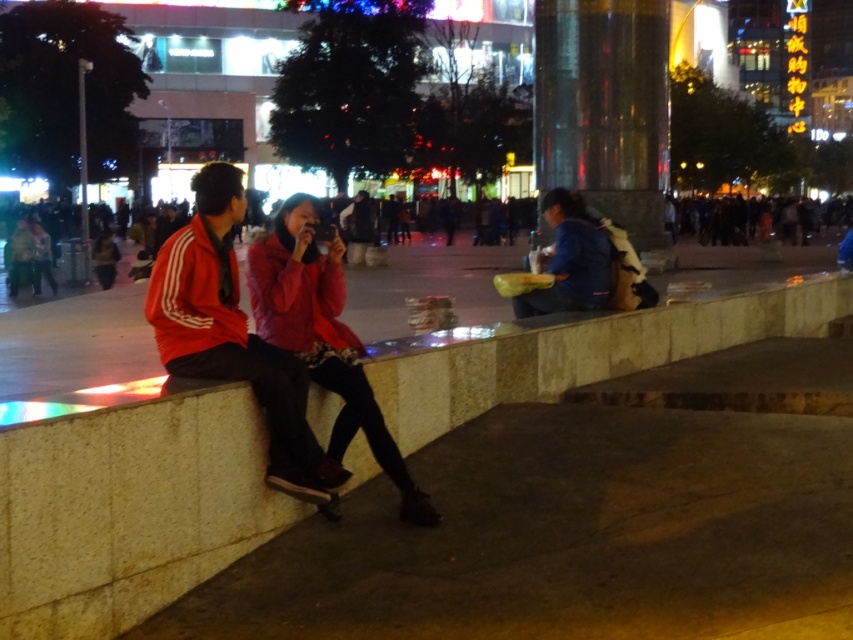
You are a photographer trying to capture a wide shot of the scene. The red matte jacket at left and the blue fabric bag at center are in your frame. Since you want to focus on the larger object, which one should you zoom in on?

The blue fabric bag at center is larger than the red matte jacket at left, so you should zoom in on the blue fabric bag at center.